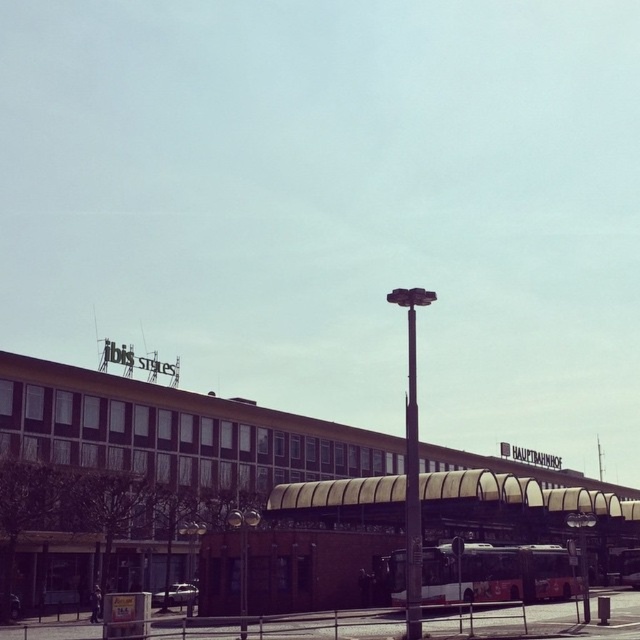
Does metallic pole at center have a lesser width compared to black metal pole at center?

No.

Does point (392, 298) come in front of point (410, 436)?

That is False.

The image size is (640, 640). In order to click on metallic pole at center in this screenshot , I will do `click(412, 461)`.

Does white glass bus station at center appear on the left side of metallic pole at center?

Incorrect, white glass bus station at center is not on the left side of metallic pole at center.

Is white glass bus station at center wider than metallic pole at center?

Indeed, white glass bus station at center has a greater width compared to metallic pole at center.

At what (x,y) coordinates should I click in order to perform the action: click on white glass bus station at center. Please return your answer as a coordinate pair (x, y). This screenshot has width=640, height=640. Looking at the image, I should click on (173, 429).

Does white glass bus station at center have a smaller size compared to black metal pole at center?

Actually, white glass bus station at center might be larger than black metal pole at center.

Can you confirm if white glass bus station at center is positioned to the left of black metal pole at center?

In fact, white glass bus station at center is to the right of black metal pole at center.

Does point (209, 436) come closer to viewer compared to point (420, 545)?

No, it is not.

The width and height of the screenshot is (640, 640). I want to click on white glass bus station at center, so click(173, 429).